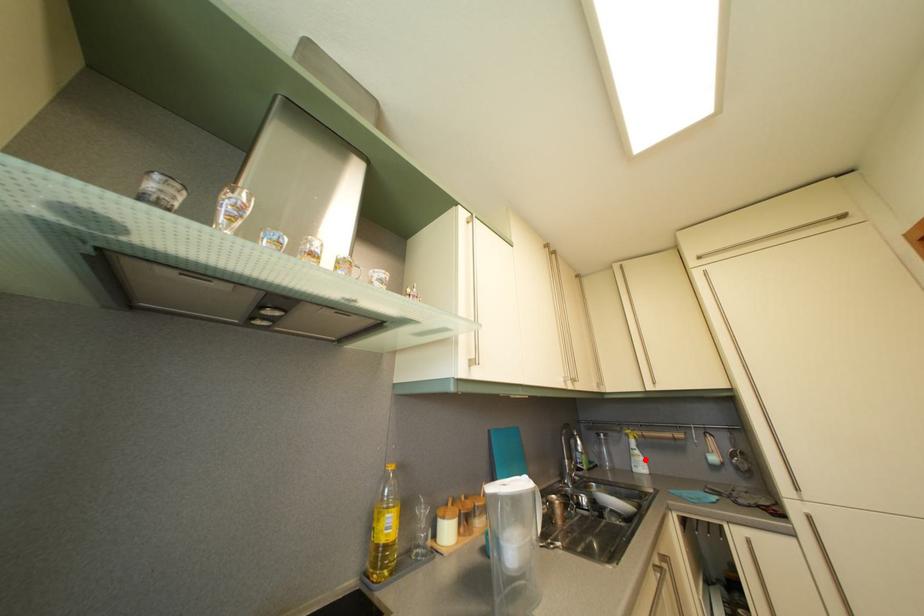
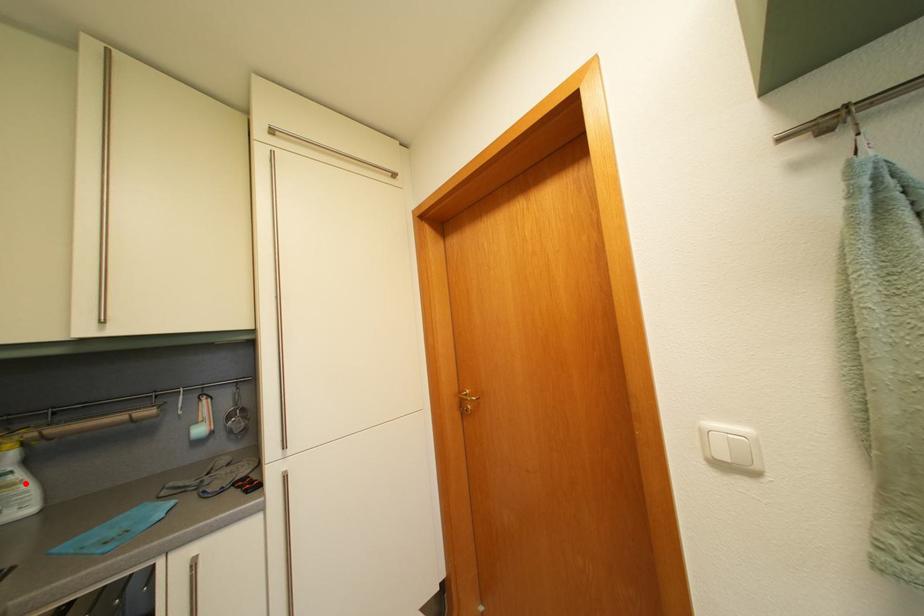
I am providing you with two images of the same scene from different viewpoints. A red point is marked on the first image and another point is marked on the second image. Do the highlighted points in image1 and image2 indicate the same real-world spot?

Yes